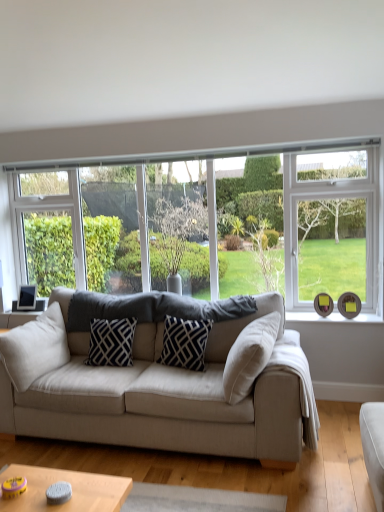
Locate an element on the screen. Image resolution: width=384 pixels, height=512 pixels. green leafy tree at center is located at coordinates (178, 234).

You are a GUI agent. You are given a task and a screenshot of the screen. Output one action in this format:
    pyautogui.click(x=<x>, y=<y>)
    Task: Click on the beige fabric couch at center
    
    Given the screenshot: What is the action you would take?
    pyautogui.click(x=170, y=397)

Where is `clear glass window at center`? clear glass window at center is located at coordinates (254, 225).

Measure the distance between point (245, 221) and camera.

Point (245, 221) is 3.83 meters away from camera.

This screenshot has height=512, width=384. Describe the element at coordinates (111, 342) in the screenshot. I see `black and white patterned pillow at center, acting as the 2th pillow starting from the left` at that location.

The height and width of the screenshot is (512, 384). What do you see at coordinates (35, 348) in the screenshot? I see `beige fabric pillow at left, which is the 3th pillow from right to left` at bounding box center [35, 348].

The width and height of the screenshot is (384, 512). I want to click on navy blue fabric pillow at center, the first pillow positioned from the right, so click(x=184, y=343).

How distant is beige fabric couch at center from green leafy tree at center?

beige fabric couch at center is 1.06 meters away from green leafy tree at center.

Considering the relative sizes of beige fabric couch at center and green leafy tree at center in the image provided, is beige fabric couch at center taller than green leafy tree at center?

Yes.

From the image's perspective, is beige fabric couch at center above green leafy tree at center?

No, from the image's perspective, beige fabric couch at center is not above green leafy tree at center.

Is beige fabric couch at center oriented away from green leafy tree at center?

That's not correct — beige fabric couch at center is not looking away from green leafy tree at center.

Is green leafy tree at center further to the viewer compared to beige fabric couch at center?

Yes.

Does green leafy tree at center touch beige fabric couch at center?

No.

At what (x,y) coordinates should I click in order to perform the action: click on tree that is above the beige fabric couch at center (from the image's perspective). Please return your answer as a coordinate pair (x, y). The width and height of the screenshot is (384, 512). Looking at the image, I should click on (178, 234).

What's the angular difference between clear glass window at center and green leafy tree at center's facing directions?

They differ by 1.44 degrees in their facing directions.

In the scene shown: From a real-world perspective, is clear glass window at center positioned above or below green leafy tree at center?

clear glass window at center is above green leafy tree at center.

Is clear glass window at center aimed at green leafy tree at center?

Yes, clear glass window at center is oriented towards green leafy tree at center.

In terms of height, does clear glass window at center look taller or shorter compared to green leafy tree at center?

Considering their sizes, clear glass window at center has more height than green leafy tree at center.

Which is correct: black and white patterned pillow at center, arranged as the second pillow when viewed from the right, is inside beige fabric couch at center, or outside of it?

black and white patterned pillow at center, arranged as the second pillow when viewed from the right, fits inside beige fabric couch at center.

You are a GUI agent. You are given a task and a screenshot of the screen. Output one action in this format:
    pyautogui.click(x=<x>, y=<y>)
    Task: Click on the studio couch that is in front of the black and white patterned pillow at center, acting as the 2th pillow starting from the left
    The image size is (384, 512).
    Given the screenshot: What is the action you would take?
    pyautogui.click(x=170, y=397)

In the scene shown: Is black and white patterned pillow at center, arranged as the second pillow when viewed from the right, facing towards beige fabric couch at center?

Yes, black and white patterned pillow at center, arranged as the second pillow when viewed from the right, faces towards beige fabric couch at center.

Considering the sizes of beige fabric couch at center and black and white patterned pillow at center, arranged as the second pillow when viewed from the right, in the image, is beige fabric couch at center bigger or smaller than black and white patterned pillow at center, arranged as the second pillow when viewed from the right,?

Clearly, beige fabric couch at center is larger in size than black and white patterned pillow at center, arranged as the second pillow when viewed from the right.

Which object is further away from the camera taking this photo, beige fabric couch at center or black and white patterned pillow at center, arranged as the second pillow when viewed from the right?

black and white patterned pillow at center, arranged as the second pillow when viewed from the right, is more distant.

Can you see beige fabric couch at center touching black and white patterned pillow at center, acting as the 2th pillow starting from the left?

No, beige fabric couch at center is not touching black and white patterned pillow at center, acting as the 2th pillow starting from the left.

How far apart are beige fabric couch at center and black and white patterned pillow at center, acting as the 2th pillow starting from the left?

47.75 centimeters.

Which pillow is the 2nd one when counting from the left side of the beige fabric couch at center? Please provide its 2D coordinates.

[(35, 348)]

Could you tell me if beige fabric couch at center is turned towards beige fabric pillow at left, which is counted as the first pillow, starting from the left?

Yes.

Consider the image. Between beige fabric couch at center and beige fabric pillow at left, which is the 3th pillow from right to left, which one has smaller width?

beige fabric pillow at left, which is the 3th pillow from right to left.

Which is nearer, (355, 276) or (292, 345)?

Positioned in front is point (292, 345).

Is clear glass window at center directly adjacent to beige fabric couch at center?

No, clear glass window at center is not with beige fabric couch at center.

Can you confirm if clear glass window at center is shorter than beige fabric couch at center?

No.

Looking at this image, is clear glass window at center facing away from beige fabric couch at center?

That's not correct — clear glass window at center is not looking away from beige fabric couch at center.

What are the coordinates of `studio couch that is below the green leafy tree at center (from the image's perspective)` in the screenshot? It's located at (170, 397).

Where is `tree behind the beige fabric couch at center`? Image resolution: width=384 pixels, height=512 pixels. tree behind the beige fabric couch at center is located at coordinates (178, 234).

From the image, which object appears to be nearer to black and white patterned pillow at center, arranged as the second pillow when viewed from the right, navy blue fabric pillow at center, the 3th pillow in the left-to-right sequence, or beige fabric couch at center?

navy blue fabric pillow at center, the 3th pillow in the left-to-right sequence, is positioned closer to the anchor black and white patterned pillow at center, arranged as the second pillow when viewed from the right.

Based on their spatial positions, is navy blue fabric pillow at center, the 3th pillow in the left-to-right sequence, or clear glass window at center closer to beige fabric pillow at left, which is the 3th pillow from right to left?

navy blue fabric pillow at center, the 3th pillow in the left-to-right sequence, lies closer to beige fabric pillow at left, which is the 3th pillow from right to left, than the other object.

From the image, which object appears to be farther from navy blue fabric pillow at center, the first pillow positioned from the right, beige fabric couch at center or clear glass window at center?

Among the two, clear glass window at center is located further to navy blue fabric pillow at center, the first pillow positioned from the right.

Which object lies nearer to the anchor point beige fabric couch at center, black and white patterned pillow at center, acting as the 2th pillow starting from the left, or clear glass window at center?

black and white patterned pillow at center, acting as the 2th pillow starting from the left, lies closer to beige fabric couch at center than the other object.

From the image, which object appears to be nearer to beige fabric pillow at left, which is the 3th pillow from right to left, green leafy tree at center or clear glass window at center?

Based on the image, green leafy tree at center appears to be nearer to beige fabric pillow at left, which is the 3th pillow from right to left.

Which object lies nearer to the anchor point clear glass window at center, navy blue fabric pillow at center, the first pillow positioned from the right, or green leafy tree at center?

green leafy tree at center is closer to clear glass window at center.

From the image, which object appears to be farther from beige fabric couch at center, beige fabric pillow at left, which is the 3th pillow from right to left, or clear glass window at center?

clear glass window at center lies further to beige fabric couch at center than the other object.

Looking at the image, which one is located closer to navy blue fabric pillow at center, the first pillow positioned from the right, clear glass window at center or beige fabric pillow at left, which is the 3th pillow from right to left?

beige fabric pillow at left, which is the 3th pillow from right to left.

Locate an element on the screen. The height and width of the screenshot is (512, 384). pillow between beige fabric pillow at left, which is counted as the first pillow, starting from the left, and clear glass window at center from left to right is located at coordinates (111, 342).

This screenshot has height=512, width=384. Find the location of `window between beige fabric pillow at left, which is counted as the first pillow, starting from the left, and navy blue fabric pillow at center, the first pillow positioned from the right, in the horizontal direction`. window between beige fabric pillow at left, which is counted as the first pillow, starting from the left, and navy blue fabric pillow at center, the first pillow positioned from the right, in the horizontal direction is located at coordinates (254, 225).

This screenshot has width=384, height=512. Identify the location of tree between beige fabric couch at center and clear glass window at center along the z-axis. (178, 234).

Where is `tree between beige fabric pillow at left, which is counted as the first pillow, starting from the left, and clear glass window at center from left to right`? The image size is (384, 512). tree between beige fabric pillow at left, which is counted as the first pillow, starting from the left, and clear glass window at center from left to right is located at coordinates (178, 234).